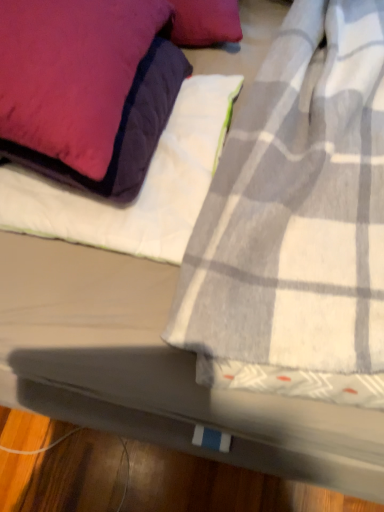
What is the approximate width of white quilted sheet at upper left?

white quilted sheet at upper left is 35.40 centimeters wide.

What do you see at coordinates (142, 186) in the screenshot?
I see `white quilted sheet at upper left` at bounding box center [142, 186].

The height and width of the screenshot is (512, 384). In order to click on white quilted sheet at upper left in this screenshot , I will do [x=142, y=186].

The image size is (384, 512). What do you see at coordinates (72, 73) in the screenshot? I see `velvet purple pillow at upper left` at bounding box center [72, 73].

The width and height of the screenshot is (384, 512). I want to click on velvet purple pillow at upper left, so click(72, 73).

The height and width of the screenshot is (512, 384). In order to click on white quilted sheet at upper left in this screenshot , I will do `click(142, 186)`.

Is white quilted sheet at upper left at the right side of velvet purple pillow at upper left?

Indeed, white quilted sheet at upper left is positioned on the right side of velvet purple pillow at upper left.

Which object is further away from the camera, white quilted sheet at upper left or velvet purple pillow at upper left?

white quilted sheet at upper left is further away from the camera.

Which is more distant, [7,178] or [132,38]?

The point [7,178] is behind.

From the image's perspective, which object appears higher, white quilted sheet at upper left or velvet purple pillow at upper left?

velvet purple pillow at upper left appears higher in the image.

From a real-world perspective, between white quilted sheet at upper left and velvet purple pillow at upper left, who is vertically lower?

white quilted sheet at upper left, from a real-world perspective.

Considering the sizes of objects white quilted sheet at upper left and velvet purple pillow at upper left in the image provided, who is thinner, white quilted sheet at upper left or velvet purple pillow at upper left?

With smaller width is white quilted sheet at upper left.

Which of these two, white quilted sheet at upper left or velvet purple pillow at upper left, stands taller?

With more height is velvet purple pillow at upper left.

Between white quilted sheet at upper left and velvet purple pillow at upper left, which one has smaller size?

With smaller size is white quilted sheet at upper left.

Do you think white quilted sheet at upper left is within velvet purple pillow at upper left, or outside of it?

The correct answer is: outside.

Is the surface of white quilted sheet at upper left in direct contact with velvet purple pillow at upper left?

No, white quilted sheet at upper left is not next to velvet purple pillow at upper left.

Is white quilted sheet at upper left aimed at velvet purple pillow at upper left?

No, white quilted sheet at upper left is not turned towards velvet purple pillow at upper left.

How many degrees apart are the facing directions of white quilted sheet at upper left and velvet purple pillow at upper left?

white quilted sheet at upper left and velvet purple pillow at upper left are facing 1.27 degrees away from each other.

The width and height of the screenshot is (384, 512). In order to click on sheet located below the velvet purple pillow at upper left (from the image's perspective) in this screenshot , I will do `click(142, 186)`.

In the image, is velvet purple pillow at upper left on the left side or the right side of white quilted sheet at upper left?

velvet purple pillow at upper left is to the left of white quilted sheet at upper left.

Considering the relative positions of velvet purple pillow at upper left and white quilted sheet at upper left in the image provided, is velvet purple pillow at upper left behind white quilted sheet at upper left?

That is False.

Does point (50, 60) appear closer or farther from the camera than point (118, 240)?

Point (50, 60) appears to be closer to the viewer than point (118, 240).

From the image's perspective, is velvet purple pillow at upper left on top of white quilted sheet at upper left?

Indeed, from the image's perspective, velvet purple pillow at upper left is shown above white quilted sheet at upper left.

From a real-world perspective, is velvet purple pillow at upper left physically located above or below white quilted sheet at upper left?

In terms of real-world spatial position, velvet purple pillow at upper left is above white quilted sheet at upper left.

Does velvet purple pillow at upper left have a greater width compared to white quilted sheet at upper left?

Yes.

From their relative heights in the image, would you say velvet purple pillow at upper left is taller or shorter than white quilted sheet at upper left?

In the image, velvet purple pillow at upper left appears to be taller than white quilted sheet at upper left.

Can you confirm if velvet purple pillow at upper left is smaller than white quilted sheet at upper left?

No, velvet purple pillow at upper left is not smaller than white quilted sheet at upper left.

Is velvet purple pillow at upper left positioned beyond the bounds of white quilted sheet at upper left?

Yes.

Is velvet purple pillow at upper left touching white quilted sheet at upper left?

velvet purple pillow at upper left and white quilted sheet at upper left are not in contact.

Is velvet purple pillow at upper left oriented towards white quilted sheet at upper left?

No.

How different are the orientations of velvet purple pillow at upper left and white quilted sheet at upper left in degrees?

They differ by 1.27 degrees in their facing directions.

Where is `pillow lying in front of the white quilted sheet at upper left`? This screenshot has width=384, height=512. pillow lying in front of the white quilted sheet at upper left is located at coordinates (72, 73).

You are a GUI agent. You are given a task and a screenshot of the screen. Output one action in this format:
    pyautogui.click(x=<x>, y=<y>)
    Task: Click on the sheet behind the velvet purple pillow at upper left
    
    Given the screenshot: What is the action you would take?
    pyautogui.click(x=142, y=186)

The height and width of the screenshot is (512, 384). I want to click on sheet below the velvet purple pillow at upper left (from a real-world perspective), so click(142, 186).